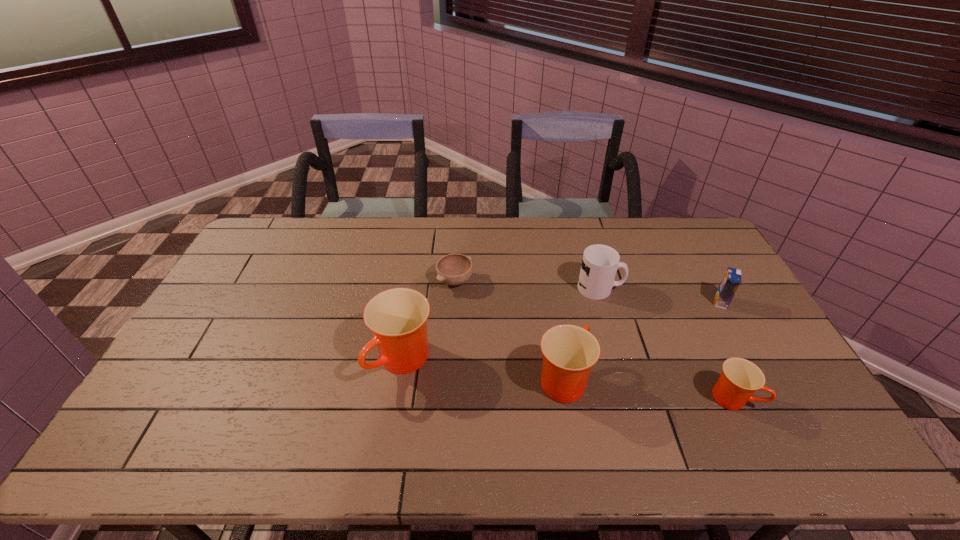
In order to click on free location located 0.390m on the left of the fifth object from left to right in this screenshot , I will do `click(561, 397)`.

The height and width of the screenshot is (540, 960). I want to click on vacant area situated on the handle side of the third object from right to left, so click(671, 288).

In order to click on vacant region located on the left of the bowl in this screenshot , I will do `click(381, 281)`.

I want to click on vacant space positioned on the front of the rightmost object, so click(x=733, y=324).

Where is `cup that is at the right edge`? The height and width of the screenshot is (540, 960). cup that is at the right edge is located at coordinates pos(740,379).

Identify the location of orange_juice located in the right edge section of the desktop. The image size is (960, 540). (732, 278).

Identify the location of object located at the near right corner. The image size is (960, 540). (740, 379).

Locate an element on the screen. Image resolution: width=960 pixels, height=540 pixels. free location at the far edge is located at coordinates (650, 240).

Locate an element on the screen. This screenshot has height=540, width=960. free space at the near edge is located at coordinates point(274,408).

This screenshot has width=960, height=540. In the image, there is a desktop. Identify the location of free region at the left edge. (232, 313).